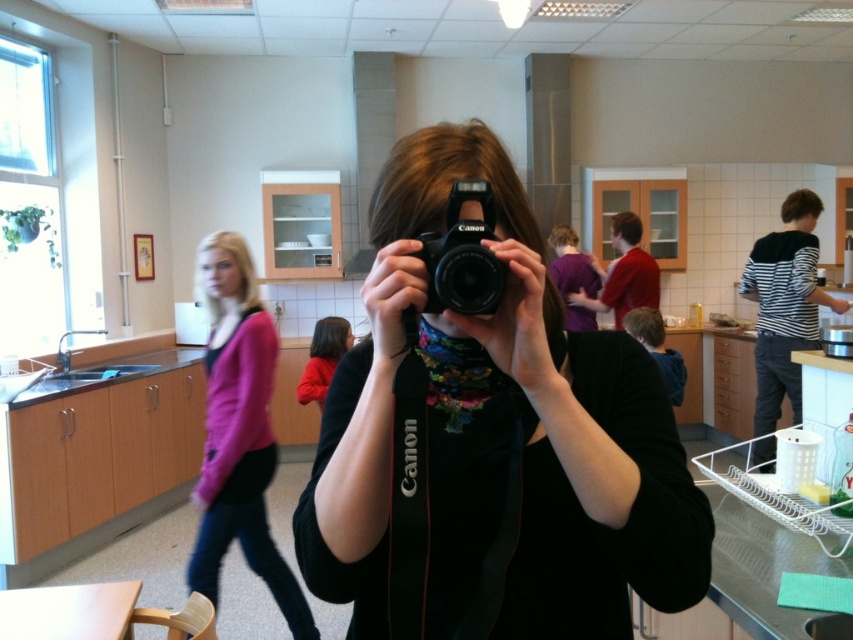
Question: Can you confirm if pink sweater at center is wider than black plastic camera at center?

Choices:
 (A) no
 (B) yes

Answer: (B)

Question: Does pink sweater at center have a smaller size compared to black plastic camera at center?

Choices:
 (A) no
 (B) yes

Answer: (A)

Question: Does pink sweater at center have a lesser width compared to black plastic camera at center?

Choices:
 (A) no
 (B) yes

Answer: (A)

Question: Which point is closer to the camera?

Choices:
 (A) (300, 618)
 (B) (645, 516)

Answer: (B)

Question: Which object appears farthest from the camera in this image?

Choices:
 (A) black plastic camera at center
 (B) pink sweater at center
 (C) black matte camera at center

Answer: (B)

Question: Considering the real-world distances, which object is farthest from the black matte camera at center?

Choices:
 (A) black plastic camera at center
 (B) pink sweater at center

Answer: (B)